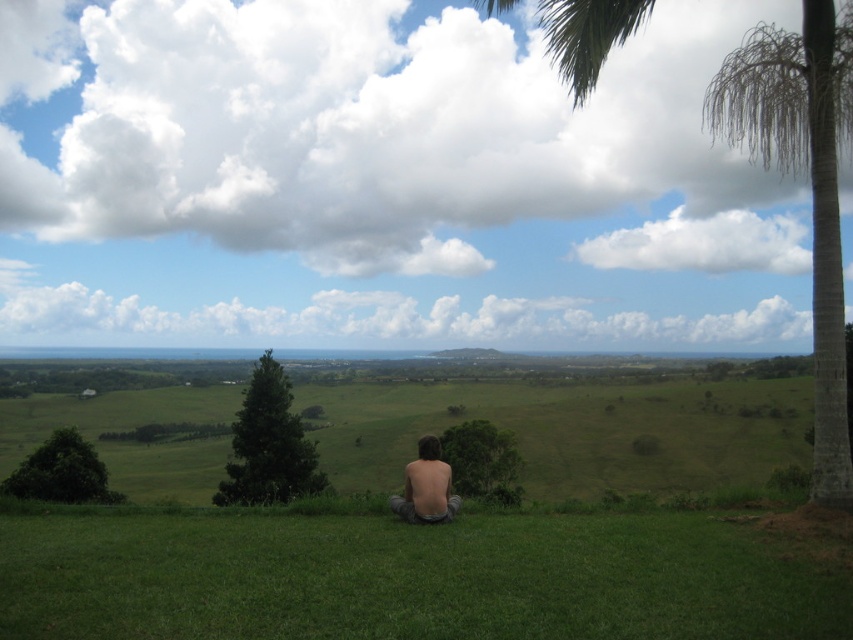
You are a photographer planning to capture a landscape photo that includes both the green textured palm tree at right and the green leafy tree at center. Based on their positions, which tree should you position closer to the foreground to maintain both in the frame without distortion?

You should position the green textured palm tree at right closer to the foreground because it is already closer to the viewer than the green leafy tree at center, ensuring both trees remain in the frame without distortion.

You are standing at the viewpoint and want to reach the point marked as point (590, 65). If your walking speed is 1.2 meters per second, how many seconds will it take you to reach that point?

The point (590, 65) is 9.67 meters away from the viewer. At a walking speed of 1.2 meters per second, it would take approximately 8.06 seconds to reach the point.